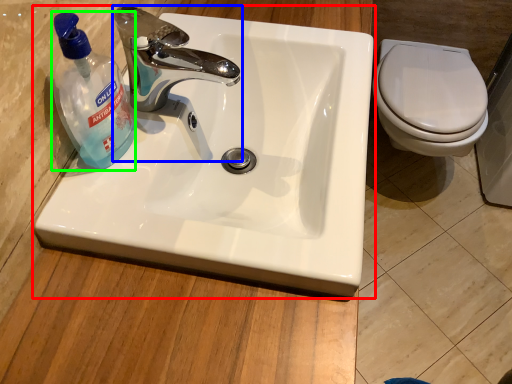
Question: Based on their relative distances, which object is farther from sink (highlighted by a red box)? Choose from tap (highlighted by a blue box) and cleaning product (highlighted by a green box).

Choices:
 (A) tap
 (B) cleaning product

Answer: (B)